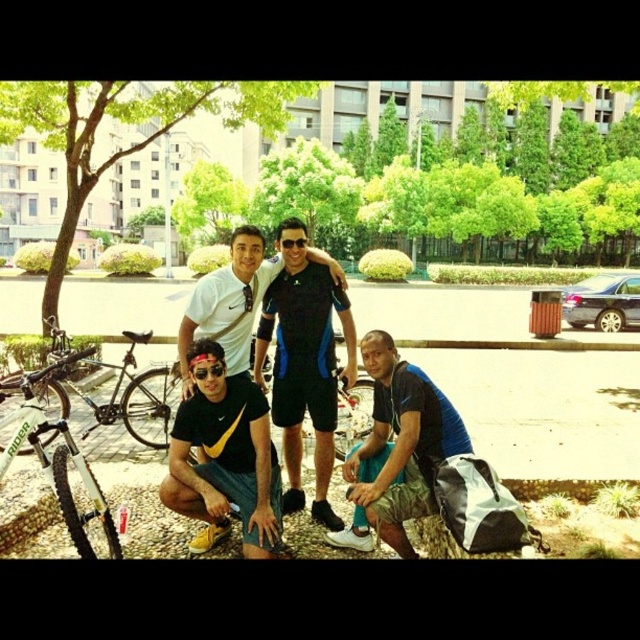
You are planning to take a photo of the blue athletic shorts at center and the silver metallic bicycle at left. Which object should you zoom in on to capture more detail without moving the camera?

The blue athletic shorts at center is thinner than the silver metallic bicycle at left, so you should zoom in on the blue athletic shorts at center to capture more detail without moving the camera since it has a smaller size and requires closer focus.